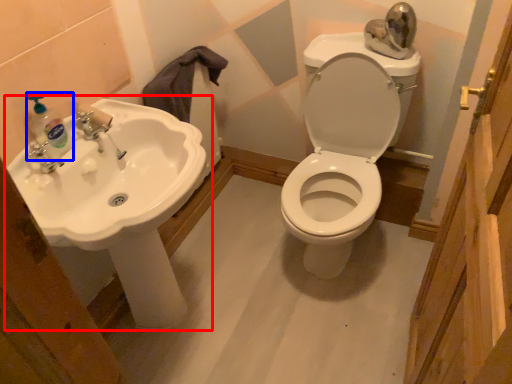
Question: Among these objects, which one is nearest to the camera, sink (highlighted by a red box) or soap dispenser (highlighted by a blue box)?

Choices:
 (A) sink
 (B) soap dispenser

Answer: (A)